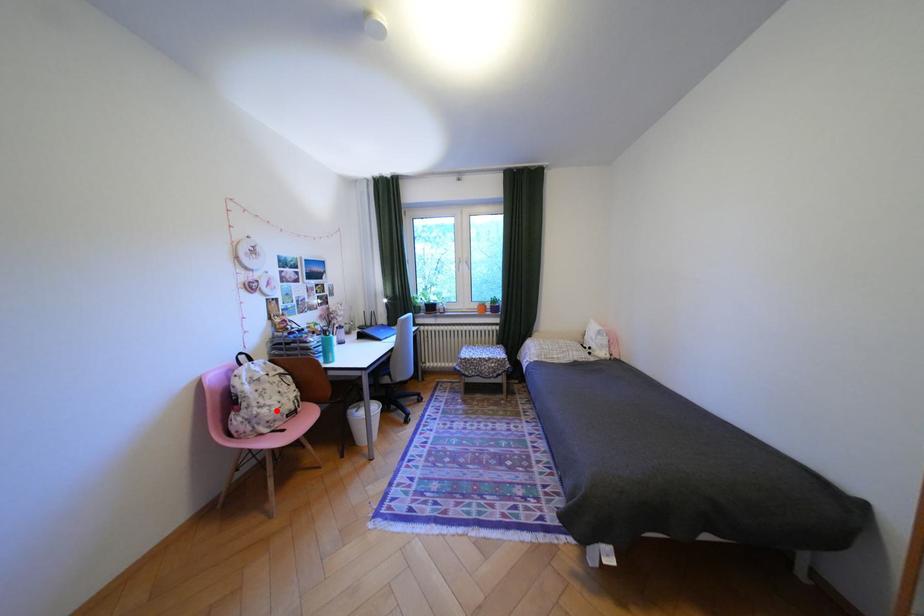
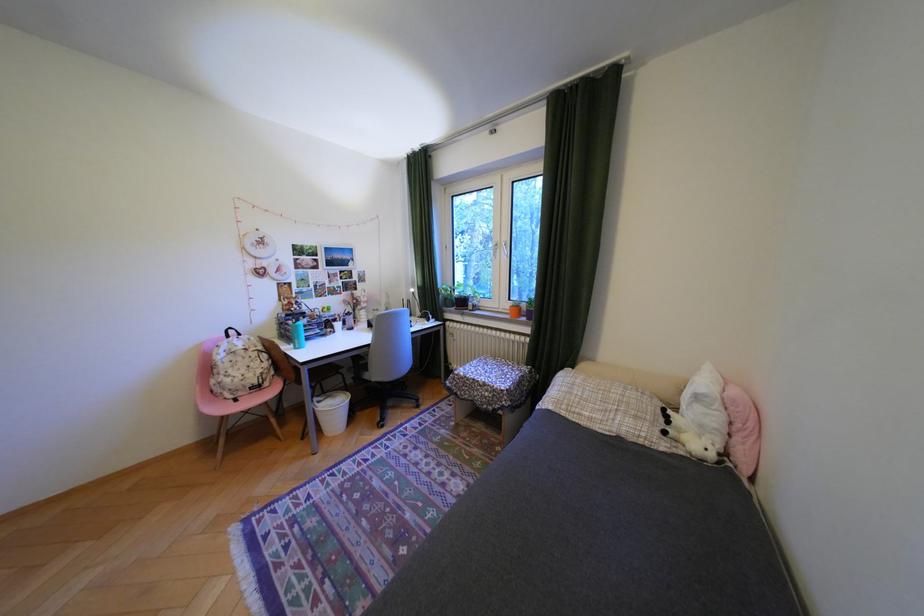
Locate, in the second image, the point that corresponds to the highlighted location in the first image.

(239, 379)